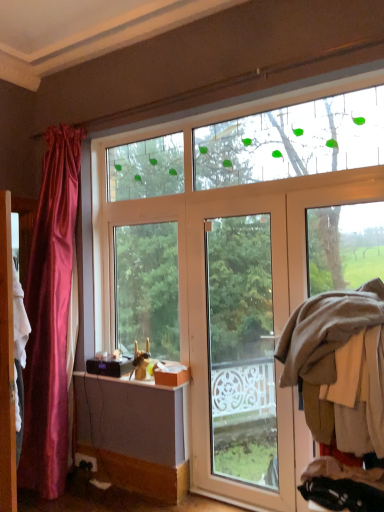
Question: Considering the relative positions of brown woolen sweater at right and white glossy door at center in the image provided, is brown woolen sweater at right to the left or to the right of white glossy door at center?

Choices:
 (A) right
 (B) left

Answer: (A)

Question: From their relative heights in the image, would you say brown woolen sweater at right is taller or shorter than white glossy door at center?

Choices:
 (A) tall
 (B) short

Answer: (B)

Question: Which of these objects is positioned closest to the white glossy door at center?

Choices:
 (A) wooden screen door at left
 (B) brown woolen sweater at right

Answer: (B)

Question: Which of these objects is positioned closest to the wooden screen door at left?

Choices:
 (A) white glossy door at center
 (B) brown woolen sweater at right

Answer: (B)